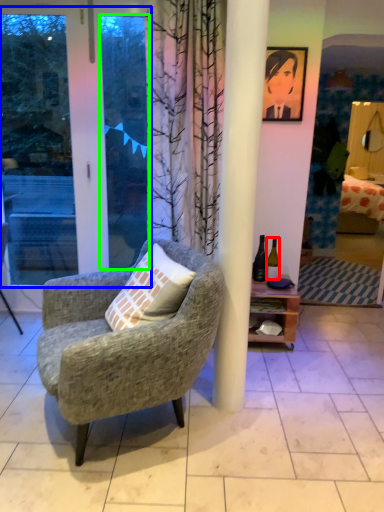
Question: Which object is the farthest from bottle (highlighted by a red box)? Choose among these: screen door (highlighted by a blue box) or window screen (highlighted by a green box).

Choices:
 (A) screen door
 (B) window screen

Answer: (A)